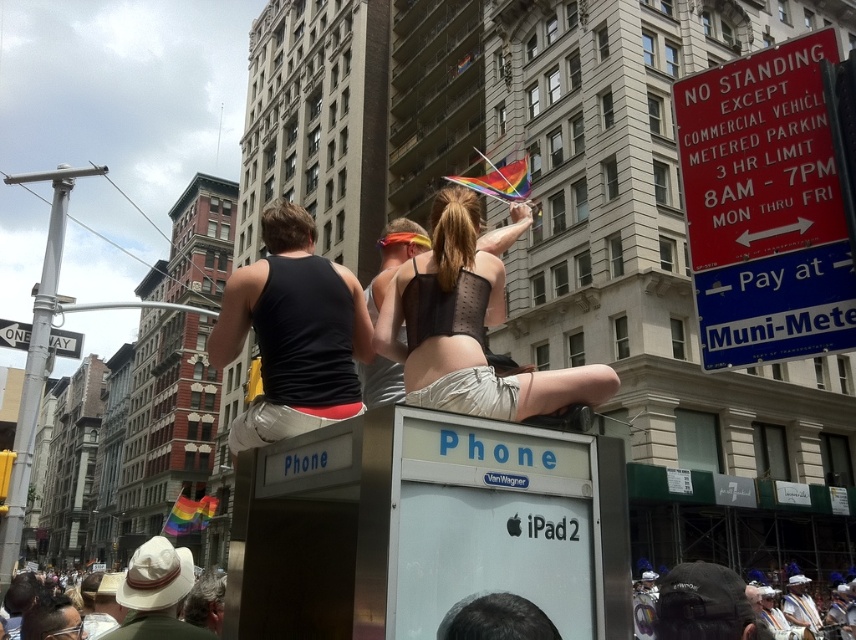
You are a photographer trying to capture a clear shot of both the black mesh top at center and the black matte tank top at center. Which one is closer to the camera based on their positions?

The black mesh top at center is in front of the black matte tank top at center, so it is closer to the camera.

You are a photographer trying to capture a clear shot of both the white fabric hat at lower left and the white cotton hat at lower center. Since you want both hats to be visible in your photo, which hat should you focus on first to ensure the other remains in the frame?

The white fabric hat at lower left is in front of the white cotton hat at lower center. To ensure both are visible, focus on the white cotton hat at lower center first, as it is behind the white fabric hat at lower left and adjust your angle so the front hat doesn t block the view of the back one.